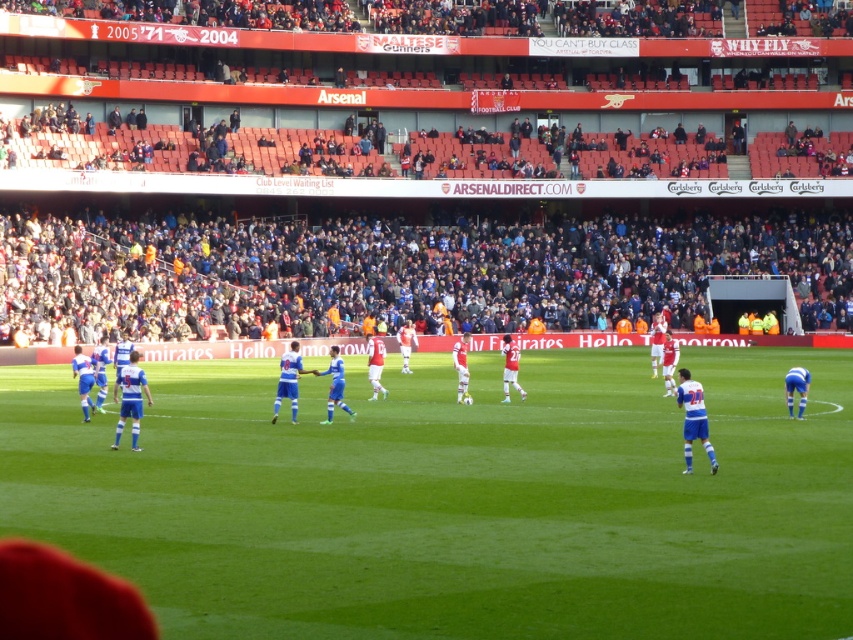
Question: Does green grass football field at center have a larger size compared to dark blue jersey at center?

Choices:
 (A) no
 (B) yes

Answer: (A)

Question: Can you confirm if green grass football field at center is thinner than blue jersey at center?

Choices:
 (A) yes
 (B) no

Answer: (A)

Question: Which point appears farthest from the camera in this image?

Choices:
 (A) (450, 289)
 (B) (196, 531)

Answer: (A)

Question: Which point is closer to the camera taking this photo?

Choices:
 (A) (811, 243)
 (B) (442, 397)

Answer: (B)

Question: Which of the following is the farthest from the observer?

Choices:
 (A) blue jersey at center
 (B) green grass football field at center

Answer: (A)

Question: Can you confirm if green grass football field at center is positioned to the left of dark blue jersey at center?

Choices:
 (A) no
 (B) yes

Answer: (B)